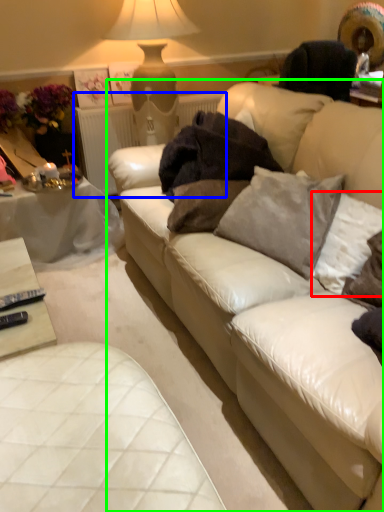
Question: Which object is positioned farthest from pillow (highlighted by a red box)? Select from radiator (highlighted by a blue box) and studio couch (highlighted by a green box).

Choices:
 (A) radiator
 (B) studio couch

Answer: (A)